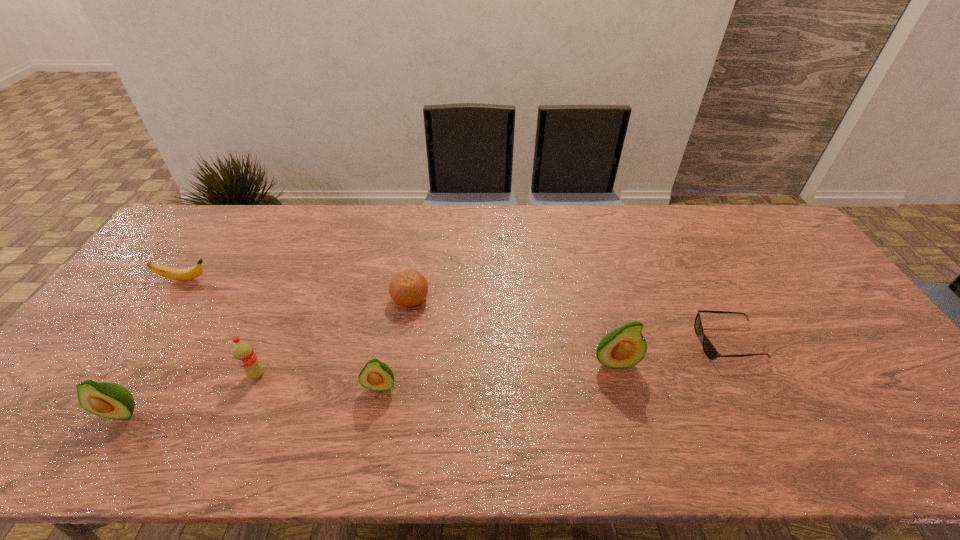
Locate an element on the screen. vacant space that satisfies the following two spatial constraints: 1. on the back side of the third object from left to right; 2. on the right side of the clementine is located at coordinates (289, 299).

This screenshot has height=540, width=960. I want to click on free space that satisfies the following two spatial constraints: 1. on the lenses of the rightmost object; 2. on the cut side of the nearest avocado, so click(763, 412).

Locate an element on the screen. This screenshot has width=960, height=540. free space that satisfies the following two spatial constraints: 1. on the lenses of the shortest object; 2. on the cut side of the second tallest avocado is located at coordinates pyautogui.click(x=763, y=412).

You are a GUI agent. You are given a task and a screenshot of the screen. Output one action in this format:
    pyautogui.click(x=<x>, y=<y>)
    Task: Click on the free space that satisfies the following two spatial constraints: 1. on the lenses of the shortest object; 2. on the cut side of the farthest avocado
    This screenshot has width=960, height=540.
    Given the screenshot: What is the action you would take?
    pyautogui.click(x=737, y=362)

At what (x,y) coordinates should I click in order to perform the action: click on blank space that satisfies the following two spatial constraints: 1. on the lenses of the shortest object; 2. on the cut side of the nearest avocado. Please return your answer as a coordinate pair (x, y). Image resolution: width=960 pixels, height=540 pixels. Looking at the image, I should click on (763, 412).

At what (x,y) coordinates should I click in order to perform the action: click on blank space that satisfies the following two spatial constraints: 1. on the back side of the clementine; 2. on the right side of the soda. Please return your answer as a coordinate pair (x, y). Looking at the image, I should click on (289, 299).

You are a GUI agent. You are given a task and a screenshot of the screen. Output one action in this format:
    pyautogui.click(x=<x>, y=<y>)
    Task: Click on the vacant space that satisfies the following two spatial constraints: 1. at the stem of the soda; 2. on the right side of the farthest object
    The width and height of the screenshot is (960, 540).
    Given the screenshot: What is the action you would take?
    pyautogui.click(x=120, y=374)

The height and width of the screenshot is (540, 960). I want to click on free location that satisfies the following two spatial constraints: 1. on the lenses of the shortest object; 2. on the cut side of the leftmost avocado, so click(763, 412).